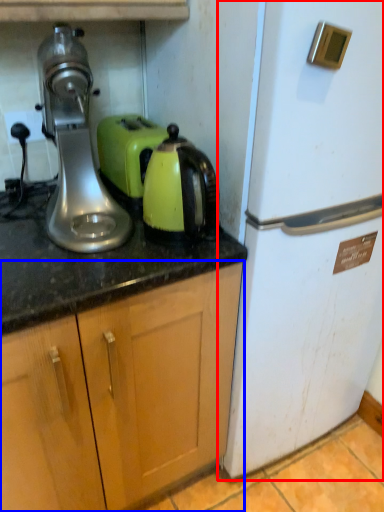
Question: Among these objects, which one is farthest to the camera, refrigerator (highlighted by a red box) or cabinetry (highlighted by a blue box)?

Choices:
 (A) refrigerator
 (B) cabinetry

Answer: (A)